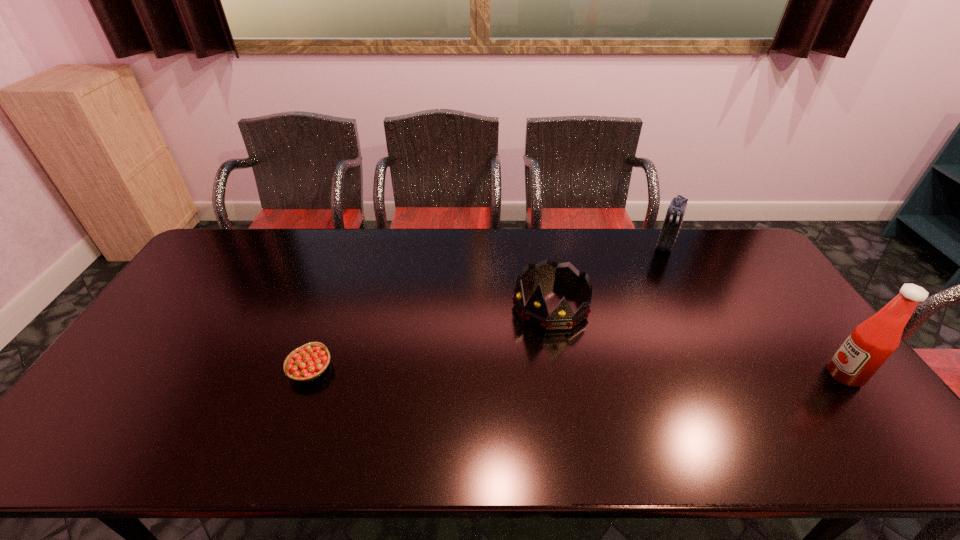
I want to click on vacant region at the far edge of the desktop, so click(x=293, y=228).

Locate an element on the screen. This screenshot has height=540, width=960. vacant space at the near edge of the desktop is located at coordinates (785, 416).

Identify the location of vacant space at the left edge of the desktop. The height and width of the screenshot is (540, 960). (179, 299).

In the image, there is a desktop. At what (x,y) coordinates should I click in order to perform the action: click on free region at the right edge. Please return your answer as a coordinate pair (x, y). Image resolution: width=960 pixels, height=540 pixels. Looking at the image, I should click on (741, 286).

In order to click on blank space at the far left corner of the desktop in this screenshot , I will do `click(224, 234)`.

The height and width of the screenshot is (540, 960). Identify the location of vacant space at the far right corner of the desktop. (709, 251).

This screenshot has height=540, width=960. What are the coordinates of `free point between the clutch bag and the second farthest object` in the screenshot? It's located at point(608,275).

The height and width of the screenshot is (540, 960). I want to click on free spot between the tiara and the condiment, so click(x=698, y=340).

This screenshot has height=540, width=960. Identify the location of vacant area that lies between the third nearest object and the condiment. (698, 340).

Identify the location of free space between the clutch bag and the rightmost object. The image size is (960, 540). [x=755, y=310].